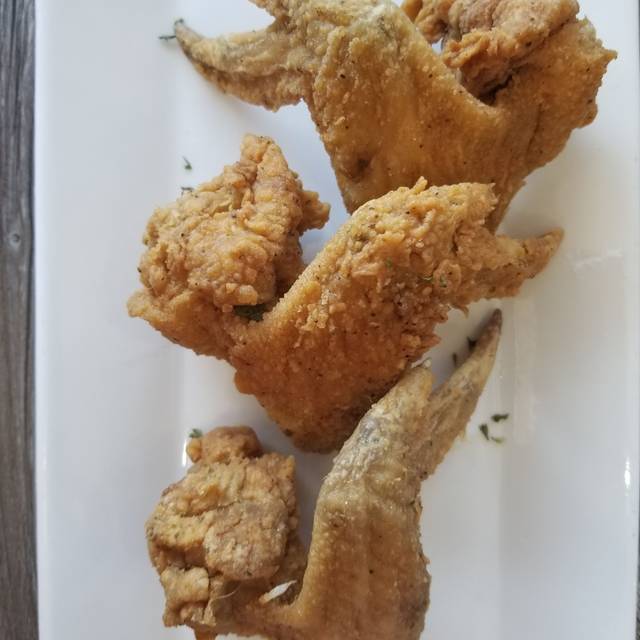
Where is `plate`? The width and height of the screenshot is (640, 640). plate is located at coordinates (589, 404).